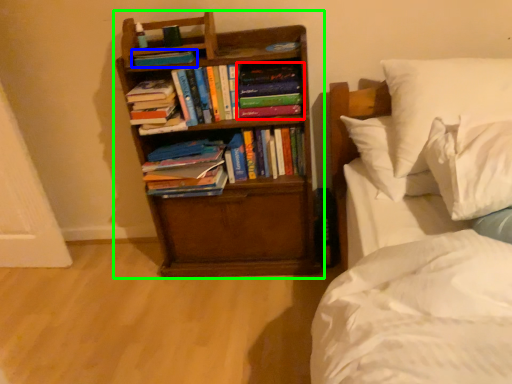
Question: Which object is positioned closest to book (highlighted by a red box)? Select from book (highlighted by a blue box) and bookcase (highlighted by a green box).

Choices:
 (A) book
 (B) bookcase

Answer: (B)